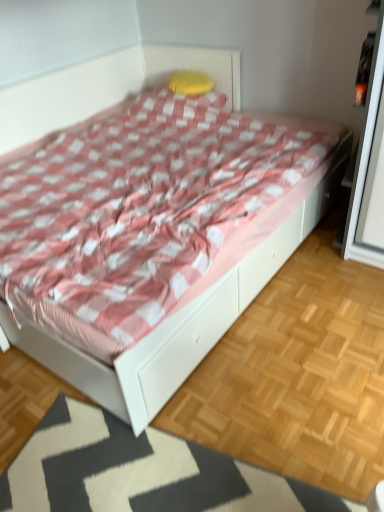
Question: Is the position of yellow fabric pillow at upper center more distant than that of white glossy bed at center?

Choices:
 (A) yes
 (B) no

Answer: (A)

Question: Is yellow fabric pillow at upper center positioned far away from white glossy bed at center?

Choices:
 (A) no
 (B) yes

Answer: (B)

Question: Is yellow fabric pillow at upper center positioned with its back to white glossy bed at center?

Choices:
 (A) no
 (B) yes

Answer: (B)

Question: From the image's perspective, is yellow fabric pillow at upper center on top of white glossy bed at center?

Choices:
 (A) yes
 (B) no

Answer: (A)

Question: From a real-world perspective, is yellow fabric pillow at upper center below white glossy bed at center?

Choices:
 (A) no
 (B) yes

Answer: (A)

Question: Is white glossy bed at center situated inside white textured mat at lower center or outside?

Choices:
 (A) inside
 (B) outside

Answer: (B)

Question: Looking at their shapes, would you say white glossy bed at center is wider or thinner than white textured mat at lower center?

Choices:
 (A) wide
 (B) thin

Answer: (A)

Question: From a real-world perspective, is white glossy bed at center positioned above or below white textured mat at lower center?

Choices:
 (A) above
 (B) below

Answer: (A)

Question: Is white glossy bed at center to the left or to the right of white textured mat at lower center in the image?

Choices:
 (A) right
 (B) left

Answer: (B)

Question: From a real-world perspective, is yellow fabric pillow at upper center physically located above or below white glossy bed at center?

Choices:
 (A) above
 (B) below

Answer: (A)

Question: In terms of size, does yellow fabric pillow at upper center appear bigger or smaller than white glossy bed at center?

Choices:
 (A) small
 (B) big

Answer: (A)

Question: Visually, is yellow fabric pillow at upper center positioned to the left or to the right of white glossy bed at center?

Choices:
 (A) left
 (B) right

Answer: (B)

Question: Considering the positions of yellow fabric pillow at upper center and white glossy bed at center in the image, is yellow fabric pillow at upper center taller or shorter than white glossy bed at center?

Choices:
 (A) tall
 (B) short

Answer: (B)

Question: In terms of width, does yellow fabric pillow at upper center look wider or thinner when compared to white textured mat at lower center?

Choices:
 (A) wide
 (B) thin

Answer: (B)

Question: Considering their positions, is yellow fabric pillow at upper center located in front of or behind white textured mat at lower center?

Choices:
 (A) front
 (B) behind

Answer: (B)